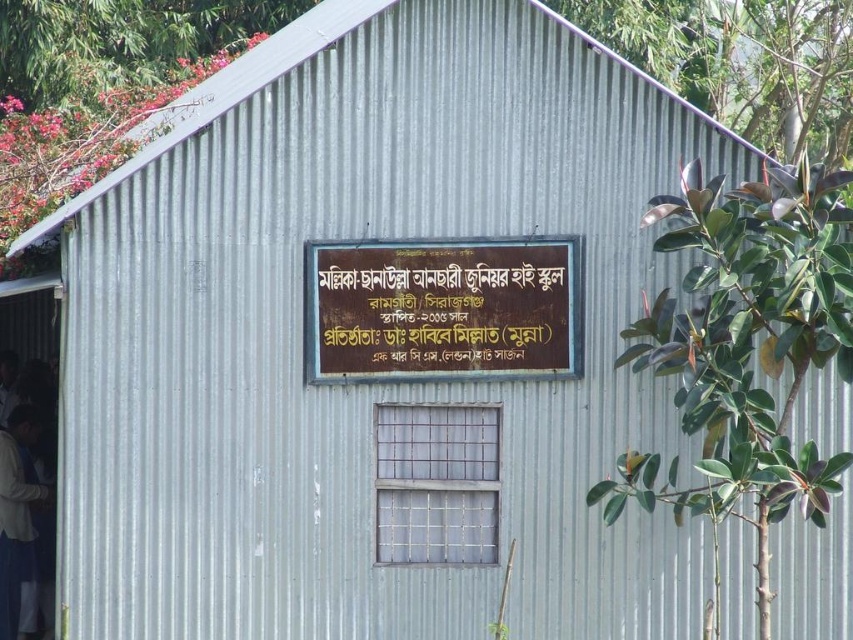
You are standing in front of the building and notice two items. One is the gold polished wood sign at center and the other is the white fabric shirt at lower left. Which item is wider?

The gold polished wood sign at center is wider than the white fabric shirt at lower left.

You are standing in front of the building and want to read the gold polished wood sign at center and the white fabric shirt at lower left. Which object is shorter?

The gold polished wood sign at center is shorter than the white fabric shirt at lower left.

Looking at this image, you are a visitor approaching the building and see the gold polished wood sign at center and the white fabric shirt at lower left. Which object is positioned higher from the ground?

The gold polished wood sign at center is located above the white fabric shirt at lower left, so it is positioned higher from the ground.